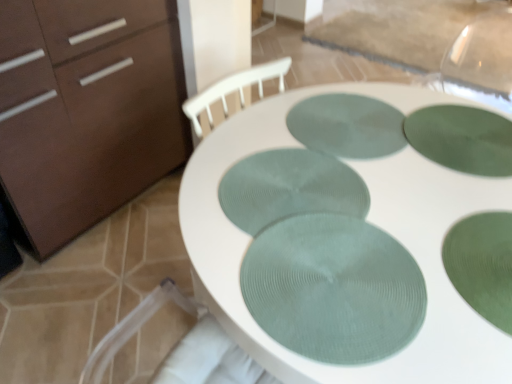
Identify the location of vacant area that lies between green textured glass plate at upper right, positioned as the 4th glass plate in front-to-back order, and green textured glass plate at center, the 3th glass plate viewed from the back. The width and height of the screenshot is (512, 384). (379, 164).